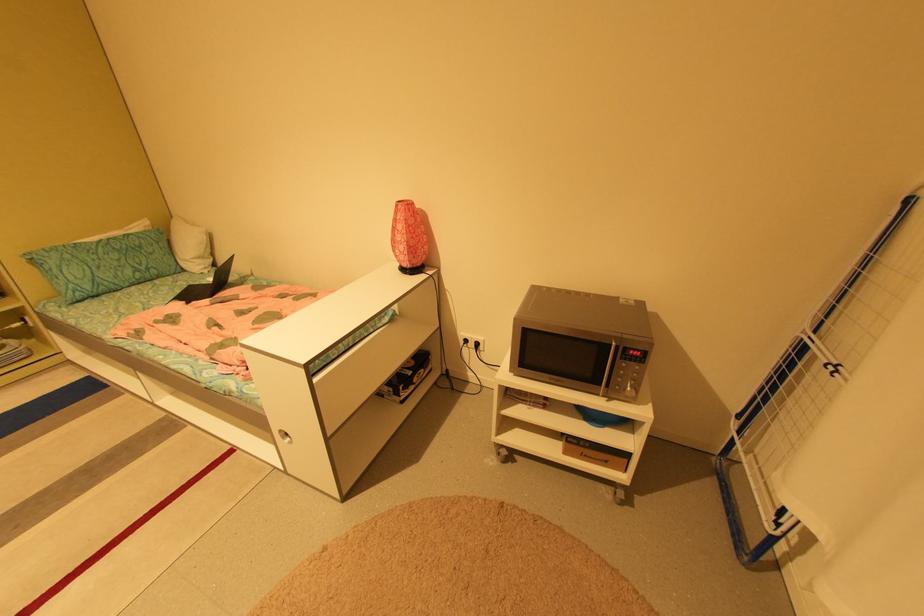
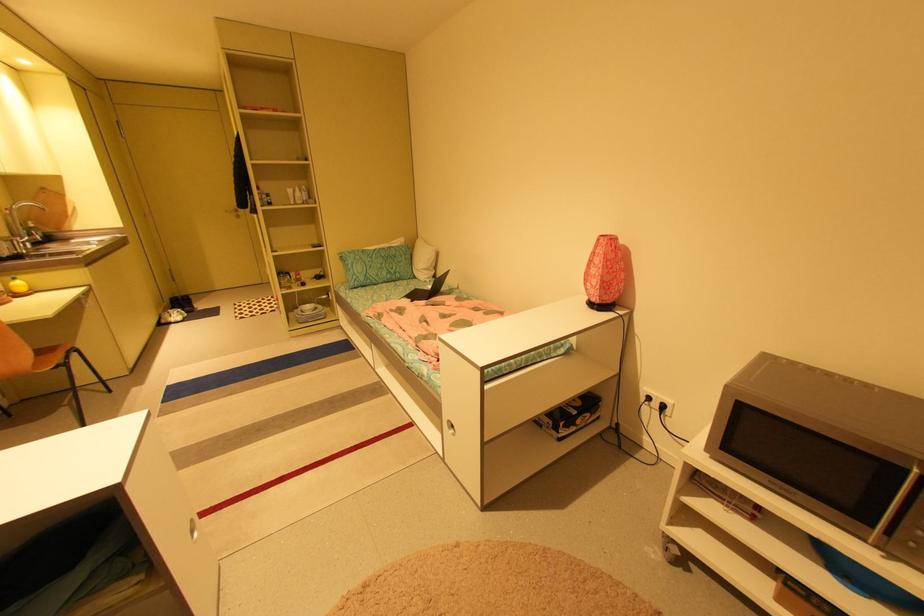
Locate, in the second image, the point that corresponds to (483,345) in the first image.

(669, 407)